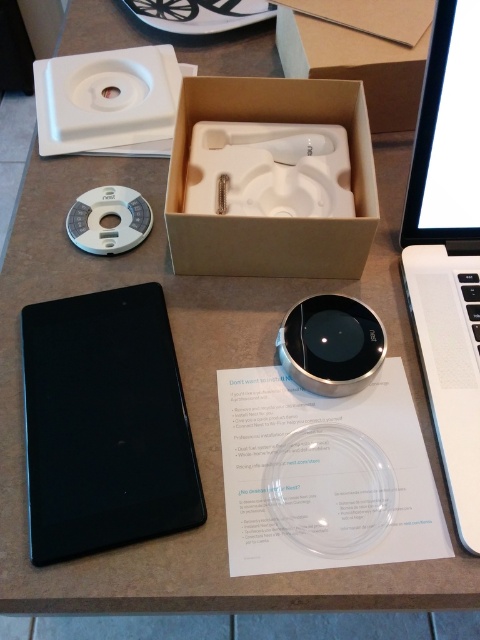
You are a technician inspecting the items on the table. You need to reach the point closer to you first. Which point should you reach first, point (x=118, y=406) or point (x=285, y=264)?

Point (x=118, y=406) is closer to the camera than point (x=285, y=264), so you should reach point (x=118, y=406) first.

In the scene shown: You are setting up a new smart thermostat system on a table. You have a white matte laptop at right and a brown cardboard box at upper center. Which object has a smaller width?

The white matte laptop at right has a smaller width than the brown cardboard box at upper center.

You are a delivery person who needs to place a new package on the table without moving any existing items. The package is 25 centimeters wide. Is there enough space between the white matte laptop at right and the brown cardboard box at upper center to fit the package?

The distance between the white matte laptop at right and the brown cardboard box at upper center is 26.39 centimeters. Since the package is 25 centimeters wide, there is enough space to fit it between them.